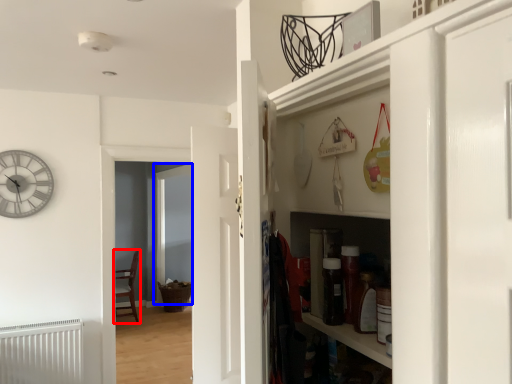
Question: Which object appears farthest to the camera in this image, chair (highlighted by a red box) or glass door (highlighted by a blue box)?

Choices:
 (A) chair
 (B) glass door

Answer: (A)